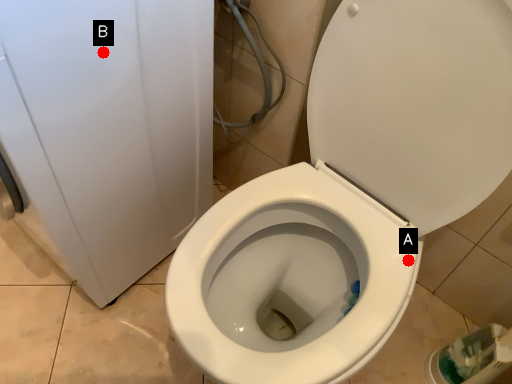
Question: Two points are circled on the image, labeled by A and B beside each circle. Which point is farther to the camera?

Choices:
 (A) A is further
 (B) B is further

Answer: (A)